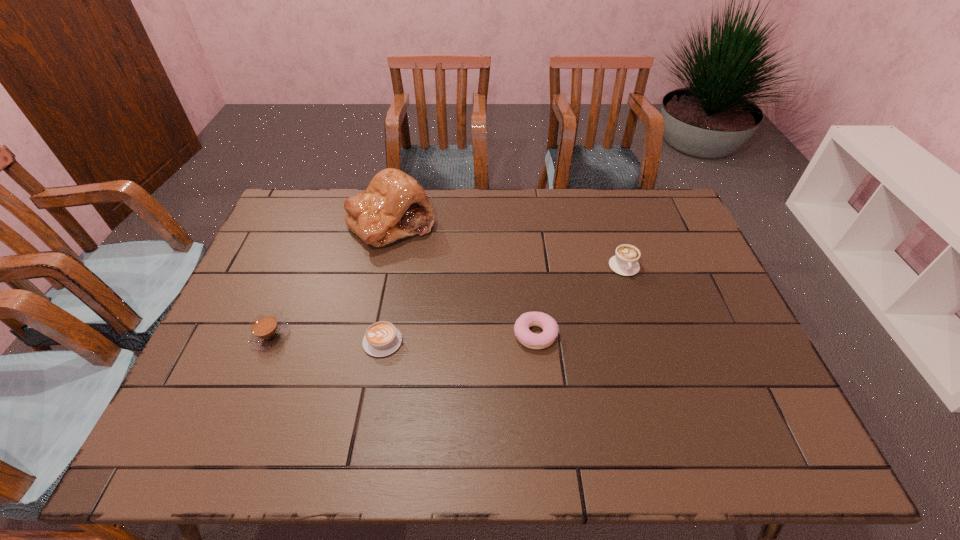
In order to click on free location located 0.390m to the right of the farthest cappuccino's handle in this screenshot , I will do `click(666, 396)`.

Identify the location of vacant space located 0.080m on the right of the leftmost cappuccino. (320, 336).

Where is `blank space located on the right of the doughnut`? blank space located on the right of the doughnut is located at coordinates (700, 335).

This screenshot has width=960, height=540. Identify the location of vacant space located 0.220m on the side of the shortest cappuccino with the handle. (489, 342).

Locate an element on the screen. object at the far edge is located at coordinates (394, 205).

The height and width of the screenshot is (540, 960). I want to click on object at the left edge, so click(266, 331).

In the image, there is a desktop. Where is `vacant space at the far edge`? vacant space at the far edge is located at coordinates click(524, 197).

Locate an element on the screen. free space at the near edge of the desktop is located at coordinates (679, 424).

This screenshot has width=960, height=540. In the image, there is a desktop. What are the coordinates of `free space at the left edge` in the screenshot? It's located at (308, 260).

You are a GUI agent. You are given a task and a screenshot of the screen. Output one action in this format:
    pyautogui.click(x=<x>, y=<y>)
    Task: Click on the free space at the right edge
    Image resolution: width=960 pixels, height=540 pixels.
    Given the screenshot: What is the action you would take?
    pyautogui.click(x=673, y=277)